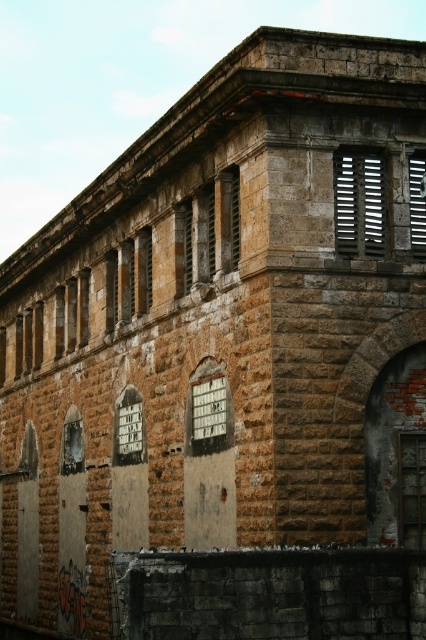
Question: Among these points, which one is nearest to the camera?

Choices:
 (A) (423, 451)
 (B) (345, 221)
 (C) (207, 424)

Answer: (A)

Question: Which point appears farthest from the camera in this image?

Choices:
 (A) pyautogui.click(x=416, y=230)
 (B) pyautogui.click(x=354, y=177)
 (C) pyautogui.click(x=66, y=433)

Answer: (C)

Question: Which object appears closest to the camera in this image?

Choices:
 (A) matte metal slats at upper right
 (B) matte wooden window at upper right
 (C) white painted wood window at center
 (D) translucent glass window at lower right

Answer: (D)

Question: Does matte metal slats at upper right have a lesser width compared to matte wooden window at upper right?

Choices:
 (A) yes
 (B) no

Answer: (B)

Question: Is white plastic window at center in front of clear glass window at lower left?

Choices:
 (A) no
 (B) yes

Answer: (B)

Question: Does matte metal slats at upper right have a greater width compared to translucent glass window at lower right?

Choices:
 (A) yes
 (B) no

Answer: (A)